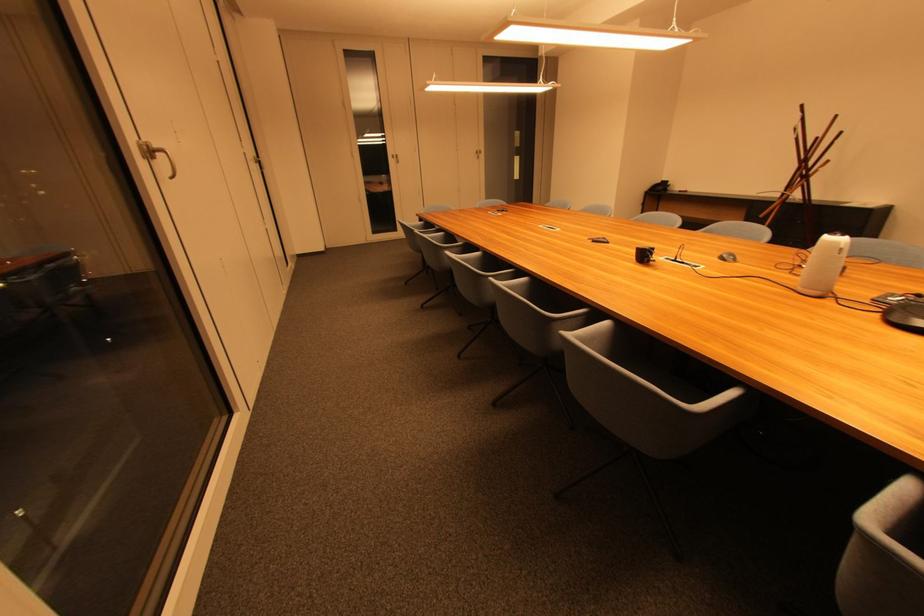
I want to click on white window handle, so click(157, 156).